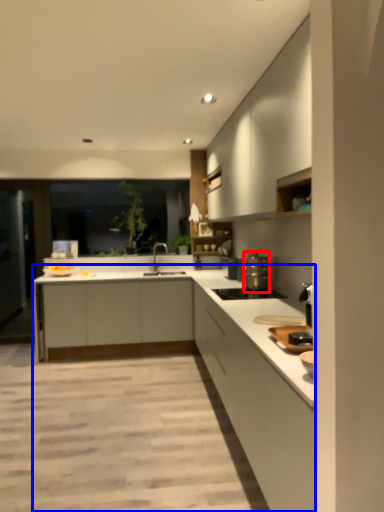
Question: Among these objects, which one is farthest to the camera, appliance (highlighted by a red box) or countertop (highlighted by a blue box)?

Choices:
 (A) appliance
 (B) countertop

Answer: (A)